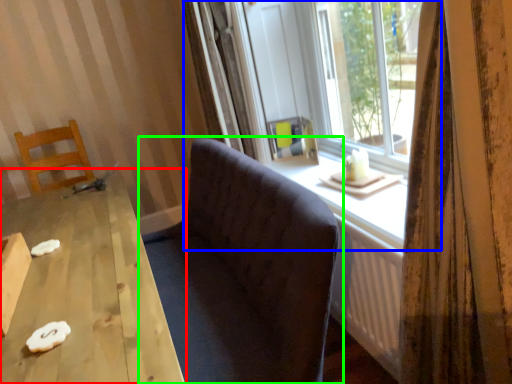
Question: Which is nearer to the table (highlighted by a red box)? window (highlighted by a blue box) or studio couch (highlighted by a green box).

Choices:
 (A) window
 (B) studio couch

Answer: (B)